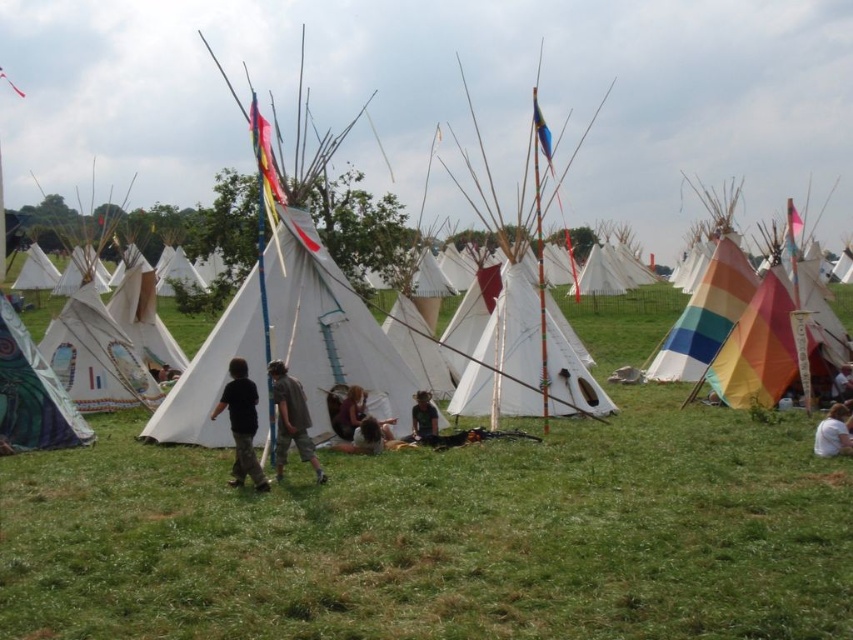
You are standing in the grassy field and see the white canvas tent at center and the white cotton shirt at lower right. Which object is closer to the left edge of the image?

The white canvas tent at center is positioned on the left side of white cotton shirt at lower right, so it is closer to the left edge of the image.

Please describe the location of the point at coordinates (328, 324) in the scene. Which object is it located on?

The point at coordinates (328, 324) is located on the white canvas tent at center.

You are standing in the grassy field and see the white canvas tent at center and the white cotton shirt at lower right. Which object is closer to you?

The white cotton shirt at lower right is closer to you because the white canvas tent at center is positioned over it, indicating it is farther away.